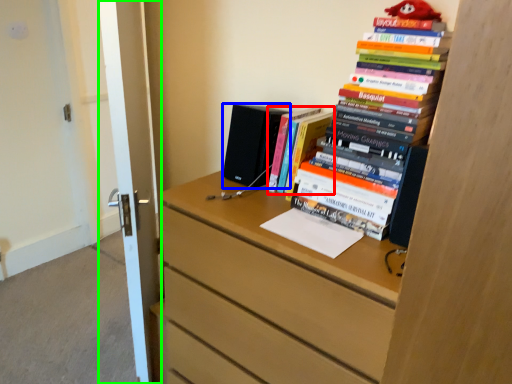
Question: Which is farther away from book (highlighted by a red box)? speaker (highlighted by a blue box) or door (highlighted by a green box)?

Choices:
 (A) speaker
 (B) door

Answer: (B)